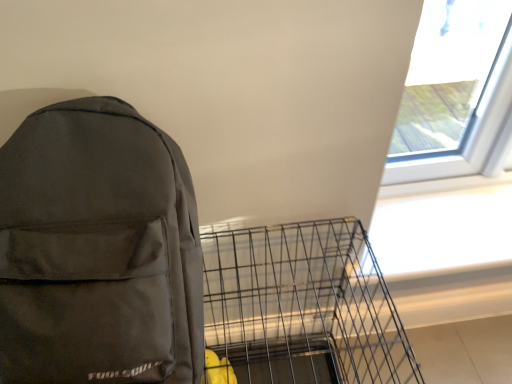
What do you see at coordinates (303, 306) in the screenshot?
I see `metallic wire birdcage at lower center` at bounding box center [303, 306].

What do you see at coordinates (98, 250) in the screenshot?
I see `matte black backpack at left` at bounding box center [98, 250].

I want to click on transparent glass window at upper right, so click(453, 91).

Find the location of a particular element. The width and height of the screenshot is (512, 384). backpack above the transparent glass window at upper right (from a real-world perspective) is located at coordinates coord(98,250).

How many degrees apart are the facing directions of transparent glass window at upper right and matte black backpack at left?

The angular difference between transparent glass window at upper right and matte black backpack at left is 5.35 degrees.

From a real-world perspective, who is located lower, transparent glass window at upper right or matte black backpack at left?

transparent glass window at upper right.

Does transparent glass window at upper right have a greater height compared to matte black backpack at left?

No, transparent glass window at upper right is not taller than matte black backpack at left.

Is metallic wire birdcage at lower center in front of or behind matte black backpack at left in the image?

Visually, metallic wire birdcage at lower center is located behind matte black backpack at left.

Visually, is metallic wire birdcage at lower center positioned to the left or to the right of matte black backpack at left?

Based on their positions, metallic wire birdcage at lower center is located to the right of matte black backpack at left.

Which of these two, metallic wire birdcage at lower center or matte black backpack at left, stands taller?

With more height is metallic wire birdcage at lower center.

Consider the image. Which is more to the right, matte black backpack at left or metallic wire birdcage at lower center?

Positioned to the right is metallic wire birdcage at lower center.

Is metallic wire birdcage at lower center surrounded by matte black backpack at left?

That's incorrect, metallic wire birdcage at lower center is not inside matte black backpack at left.

Does matte black backpack at left turn towards metallic wire birdcage at lower center?

No, matte black backpack at left does not turn towards metallic wire birdcage at lower center.

In the scene shown: From the image's perspective, which is above, metallic wire birdcage at lower center or transparent glass window at upper right?

transparent glass window at upper right.

From a real-world perspective, is metallic wire birdcage at lower center on top of transparent glass window at upper right?

No, from a real-world perspective, metallic wire birdcage at lower center is not above transparent glass window at upper right.

Considering the relative sizes of metallic wire birdcage at lower center and transparent glass window at upper right in the image provided, is metallic wire birdcage at lower center shorter than transparent glass window at upper right?

Incorrect, the height of metallic wire birdcage at lower center does not fall short of that of transparent glass window at upper right.

Is point (86, 266) less distant than point (462, 45)?

That is True.

In terms of size, does matte black backpack at left appear bigger or smaller than transparent glass window at upper right?

matte black backpack at left is bigger than transparent glass window at upper right.

I want to click on window located behind the matte black backpack at left, so click(453, 91).

Is matte black backpack at left wider or thinner than transparent glass window at upper right?

Clearly, matte black backpack at left has more width compared to transparent glass window at upper right.

Considering the sizes of objects transparent glass window at upper right and metallic wire birdcage at lower center in the image provided, who is taller, transparent glass window at upper right or metallic wire birdcage at lower center?

metallic wire birdcage at lower center.

From a real-world perspective, who is located lower, transparent glass window at upper right or metallic wire birdcage at lower center?

From a 3D spatial view, metallic wire birdcage at lower center is below.

Is point (490, 143) less distant than point (211, 243)?

No, (490, 143) is further to viewer.

From the image's perspective, is transparent glass window at upper right located above metallic wire birdcage at lower center?

Yes, from the image's perspective, transparent glass window at upper right is above metallic wire birdcage at lower center.

You are a GUI agent. You are given a task and a screenshot of the screen. Output one action in this format:
    pyautogui.click(x=<x>, y=<y>)
    Task: Click on the window on the right side of matte black backpack at left
    This screenshot has width=512, height=384.
    Given the screenshot: What is the action you would take?
    pyautogui.click(x=453, y=91)

I want to click on backpack that appears in front of the metallic wire birdcage at lower center, so click(98, 250).

Based on their spatial positions, is transparent glass window at upper right or matte black backpack at left closer to metallic wire birdcage at lower center?

Among the two, matte black backpack at left is located nearer to metallic wire birdcage at lower center.

Based on the photo, looking at the image, which one is located closer to matte black backpack at left, metallic wire birdcage at lower center or transparent glass window at upper right?

The object closer to matte black backpack at left is metallic wire birdcage at lower center.

Estimate the real-world distances between objects in this image. Which object is further from transparent glass window at upper right, metallic wire birdcage at lower center or matte black backpack at left?

Among the two, matte black backpack at left is located further to transparent glass window at upper right.

When comparing their distances from metallic wire birdcage at lower center, does matte black backpack at left or transparent glass window at upper right seem closer?

matte black backpack at left is positioned closer to the anchor metallic wire birdcage at lower center.

Which object lies further to the anchor point matte black backpack at left, transparent glass window at upper right or metallic wire birdcage at lower center?

transparent glass window at upper right is positioned further to the anchor matte black backpack at left.

Looking at the image, which one is located closer to transparent glass window at upper right, matte black backpack at left or metallic wire birdcage at lower center?

metallic wire birdcage at lower center.

The image size is (512, 384). Find the location of `bird cage located between matte black backpack at left and transparent glass window at upper right in the left-right direction`. bird cage located between matte black backpack at left and transparent glass window at upper right in the left-right direction is located at coordinates tap(303, 306).